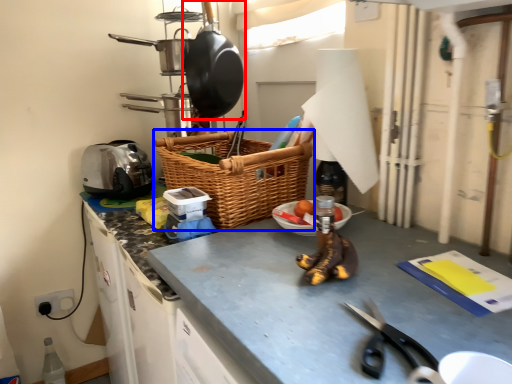
Question: Which object appears farthest to the camera in this image, frying pan (highlighted by a red box) or picnic basket (highlighted by a blue box)?

Choices:
 (A) frying pan
 (B) picnic basket

Answer: (A)